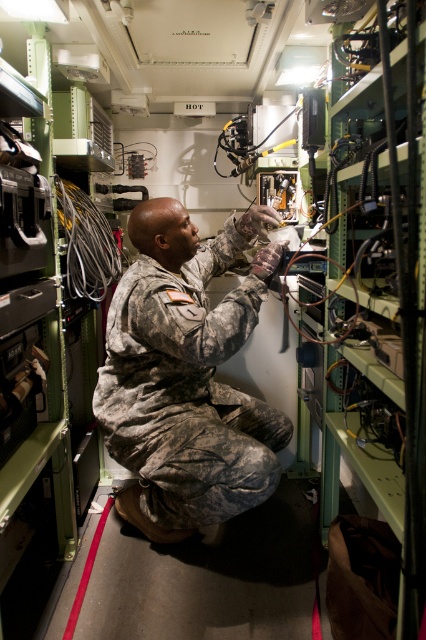
Between camouflage fabric uniform at center and black rubber wire at center, which one appears on the left side from the viewer's perspective?

black rubber wire at center

Between point (213, 451) and point (114, 266), which one is positioned in front?

Point (213, 451) is more forward.

Is point (127, 436) closer to camera compared to point (63, 202)?

Yes.

Where is `camouflage fabric uniform at center`? Image resolution: width=426 pixels, height=640 pixels. camouflage fabric uniform at center is located at coordinates (187, 376).